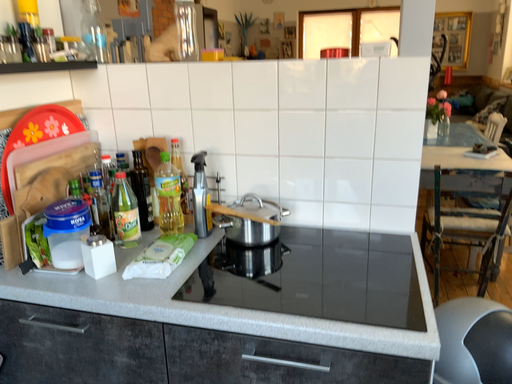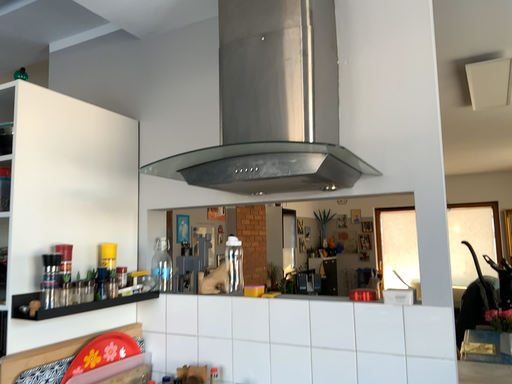
Question: How did the camera likely rotate when shooting the video?

Choices:
 (A) rotated downward
 (B) rotated upward

Answer: (B)